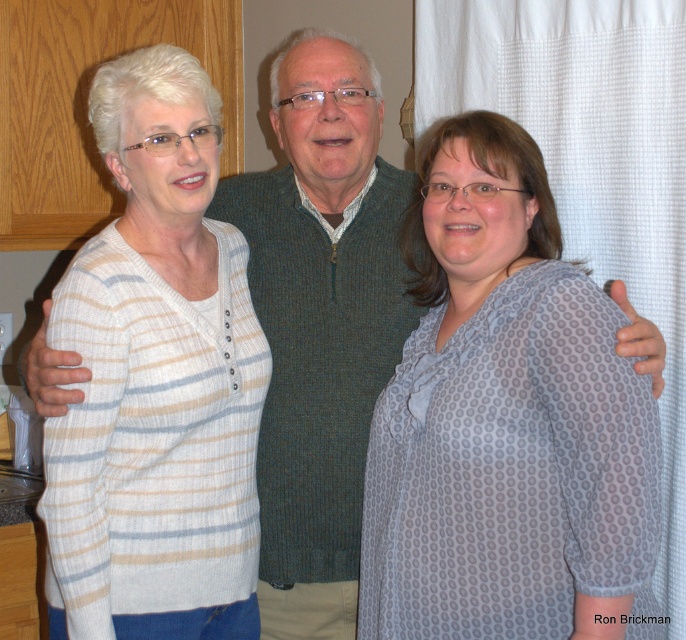
Who is taller, gray dotted blouse at center or white striped sweater at left?

white striped sweater at left

What do you see at coordinates (504, 417) in the screenshot?
I see `gray dotted blouse at center` at bounding box center [504, 417].

Is point (499, 344) positioned after point (152, 349)?

No, it is in front of (152, 349).

Identify the location of gray dotted blouse at center. The image size is (686, 640). (504, 417).